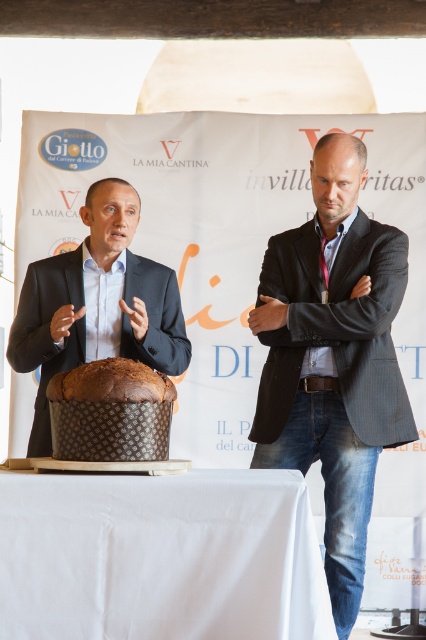
You are at a formal event and see the white cloth at lower center and the brown textured chocolate cake at center. Where is the white cloth in relation to the cake?

The white cloth at lower center is located below the brown textured chocolate cake at center.

You are at a promotional event for La Mia Cantina and need to place a small gift on the table. The gift must be placed to the left of the brown textured chocolate cake at center. Where should you place it relative to the white cloth at lower center?

The white cloth at lower center is to the right of the brown textured chocolate cake at center, so to place the gift to the left of the brown textured chocolate cake at center, you should place it to the left of the white cloth at lower center.